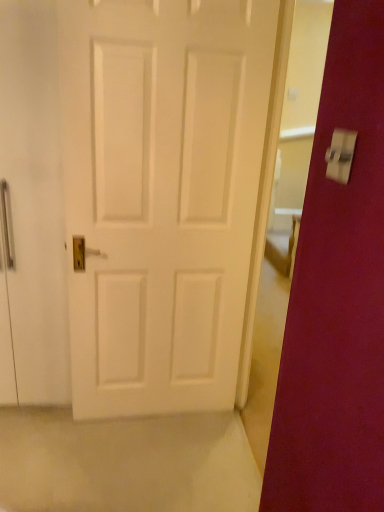
Describe the element at coordinates (340, 155) in the screenshot. Image resolution: width=384 pixels, height=512 pixels. I see `metallic silver switch at upper right` at that location.

Where is `metallic silver switch at upper right`? The width and height of the screenshot is (384, 512). metallic silver switch at upper right is located at coordinates (340, 155).

The width and height of the screenshot is (384, 512). I want to click on white matte door at center, so click(161, 196).

From the picture: What is the approximate height of white matte door at center?

The height of white matte door at center is 1.78 meters.

The image size is (384, 512). Describe the element at coordinates (161, 196) in the screenshot. I see `white matte door at center` at that location.

Locate an element on the screen. This screenshot has width=384, height=512. metallic silver switch at upper right is located at coordinates (340, 155).

Does white matte door at center appear on the left side of metallic silver switch at upper right?

Correct, you'll find white matte door at center to the left of metallic silver switch at upper right.

Considering their positions, is white matte door at center located in front of or behind metallic silver switch at upper right?

In the image, white matte door at center appears behind metallic silver switch at upper right.

Is point (232, 185) positioned in front of point (341, 173)?

No.

From the image's perspective, is white matte door at center below metallic silver switch at upper right?

Yes.

From a real-world perspective, is white matte door at center below metallic silver switch at upper right?

Yes, from a real-world perspective, white matte door at center is beneath metallic silver switch at upper right.

Can you confirm if white matte door at center is wider than metallic silver switch at upper right?

Yes.

Considering the sizes of white matte door at center and metallic silver switch at upper right in the image, is white matte door at center taller or shorter than metallic silver switch at upper right?

Clearly, white matte door at center is taller compared to metallic silver switch at upper right.

Is white matte door at center bigger than metallic silver switch at upper right?

Yes.

Do you think white matte door at center is within metallic silver switch at upper right, or outside of it?

white matte door at center is spatially situated outside metallic silver switch at upper right.

Is white matte door at center far away from metallic silver switch at upper right?

That's right, there is a large distance between white matte door at center and metallic silver switch at upper right.

From the picture: Does white matte door at center turn towards metallic silver switch at upper right?

Yes, white matte door at center is turned towards metallic silver switch at upper right.

Identify the location of door lying behind the metallic silver switch at upper right. The width and height of the screenshot is (384, 512). (161, 196).

In the scene shown: Considering the positions of objects metallic silver switch at upper right and white matte door at center in the image provided, who is more to the left, metallic silver switch at upper right or white matte door at center?

white matte door at center.

Who is more distant, metallic silver switch at upper right or white matte door at center?

white matte door at center is further from the camera.

Is point (327, 165) closer to viewer compared to point (202, 238)?

Yes, point (327, 165) is closer to viewer.

From the image's perspective, which is below, metallic silver switch at upper right or white matte door at center?

white matte door at center, from the image's perspective.

From a real-world perspective, which object stands above the other?

metallic silver switch at upper right, from a real-world perspective.

Which object is thinner, metallic silver switch at upper right or white matte door at center?

metallic silver switch at upper right.

Which of these two, metallic silver switch at upper right or white matte door at center, stands shorter?

With less height is metallic silver switch at upper right.

Between metallic silver switch at upper right and white matte door at center, which one has larger size?

white matte door at center.

Is white matte door at center surrounded by metallic silver switch at upper right?

That's incorrect, white matte door at center is not inside metallic silver switch at upper right.

Is metallic silver switch at upper right far from white matte door at center?

Yes, metallic silver switch at upper right and white matte door at center are quite far apart.

Is metallic silver switch at upper right turned away from white matte door at center?

→ metallic silver switch at upper right does not have its back to white matte door at center.

How far apart are metallic silver switch at upper right and white matte door at center?

metallic silver switch at upper right and white matte door at center are 1.04 meters apart.

You are a GUI agent. You are given a task and a screenshot of the screen. Output one action in this format:
    pyautogui.click(x=<x>, y=<y>)
    Task: Click on the light switch that appears in front of the white matte door at center
    
    Given the screenshot: What is the action you would take?
    pyautogui.click(x=340, y=155)

The height and width of the screenshot is (512, 384). I want to click on door that appears below the metallic silver switch at upper right (from the image's perspective), so click(x=161, y=196).

The image size is (384, 512). Find the location of `light switch located on the right of white matte door at center`. light switch located on the right of white matte door at center is located at coordinates (340, 155).